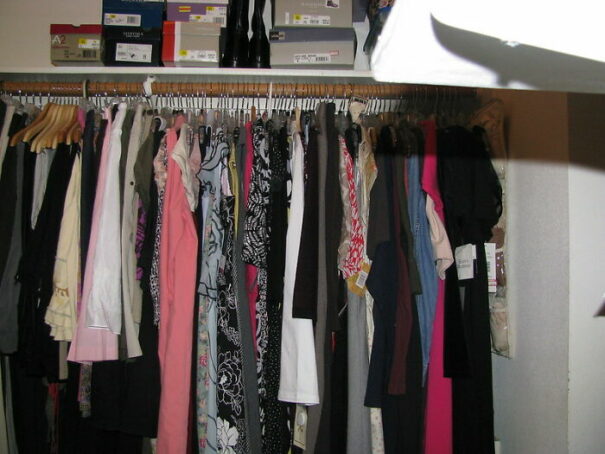
Identify the location of hanger bar. (210, 90).